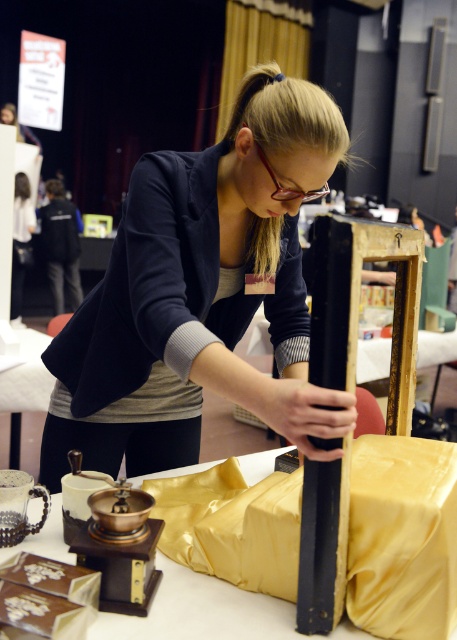
Question: Can you confirm if matte black pole at center is positioned to the left of gold satin table at lower center?

Choices:
 (A) yes
 (B) no

Answer: (A)

Question: Among these points, which one is nearest to the camera?

Choices:
 (A) (216, 621)
 (B) (266, 211)

Answer: (A)

Question: Does matte black pole at center come in front of gold satin table at lower center?

Choices:
 (A) yes
 (B) no

Answer: (B)

Question: Which point appears closest to the camera in this image?

Choices:
 (A) (57, 536)
 (B) (170, 392)

Answer: (A)

Question: Is matte black pole at center wider than gold satin table at lower center?

Choices:
 (A) yes
 (B) no

Answer: (B)